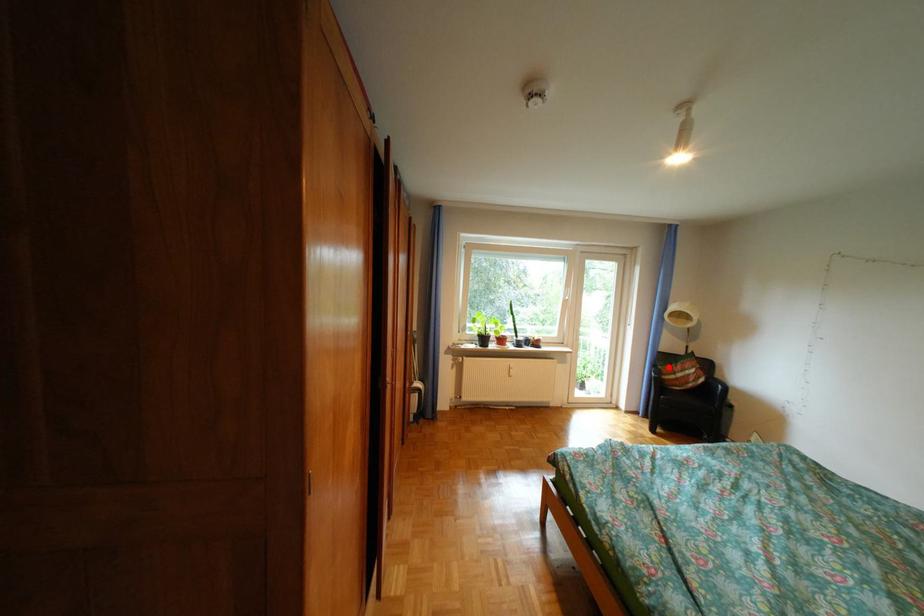
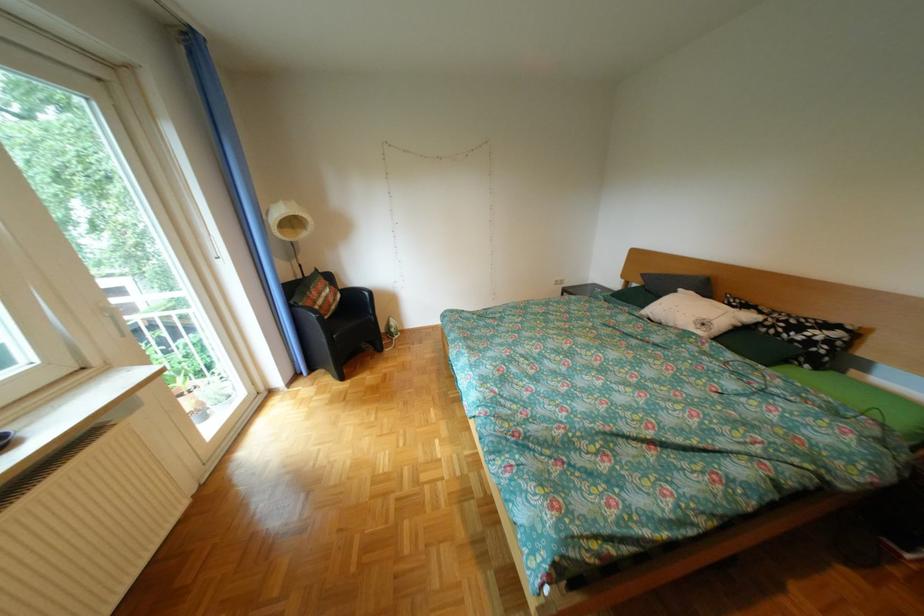
Question: I am providing you with two images of the same scene from different viewpoints. A red point is shown in image1. For the corresponding object point in image2, is it positioned nearer or farther from the camera?

Choices:
 (A) Nearer
 (B) Farther

Answer: (A)